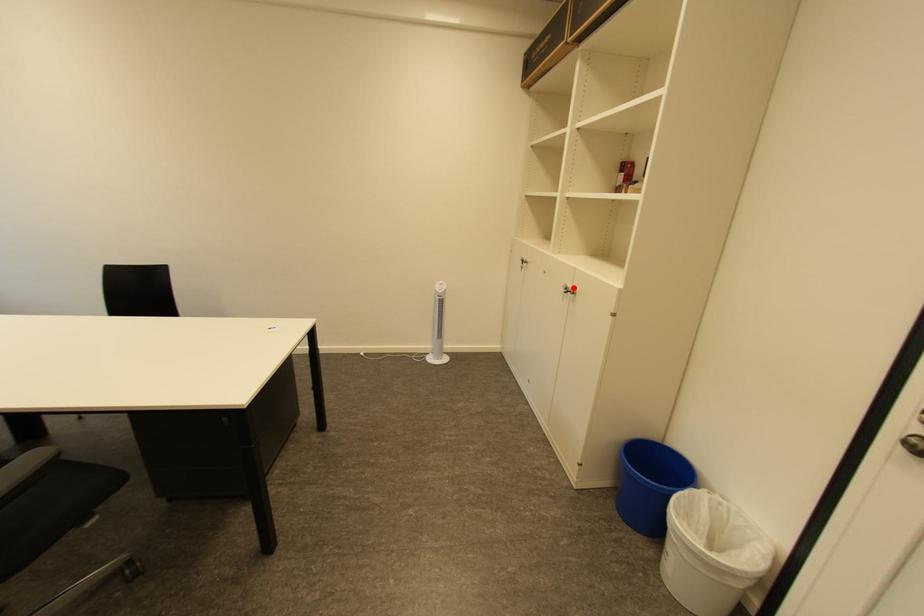
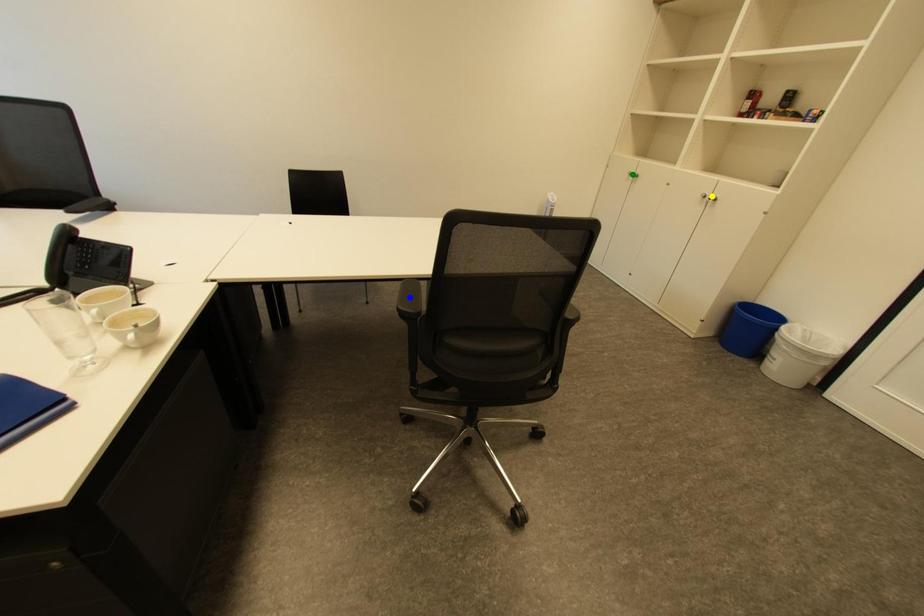
Question: I am providing you with two images of the same scene from different viewpoints. A red point is marked on the first image. You are given multiple points on the second image. Which point in image 2 is actually the same real-world point as the red point in image 1?

Choices:
 (A) yellow point
 (B) green point
 (C) blue point

Answer: (A)